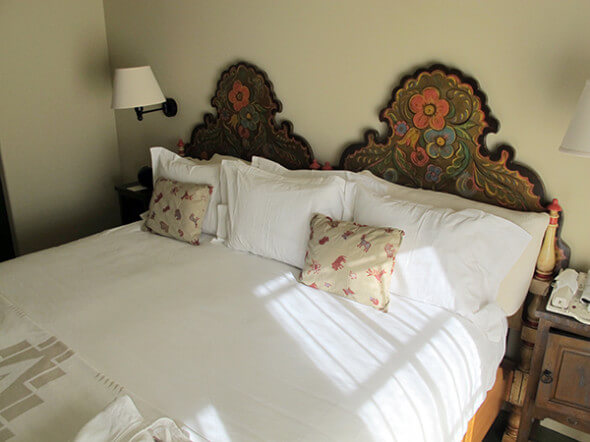
Where is `bed cover`? bed cover is located at coordinates click(76, 402).